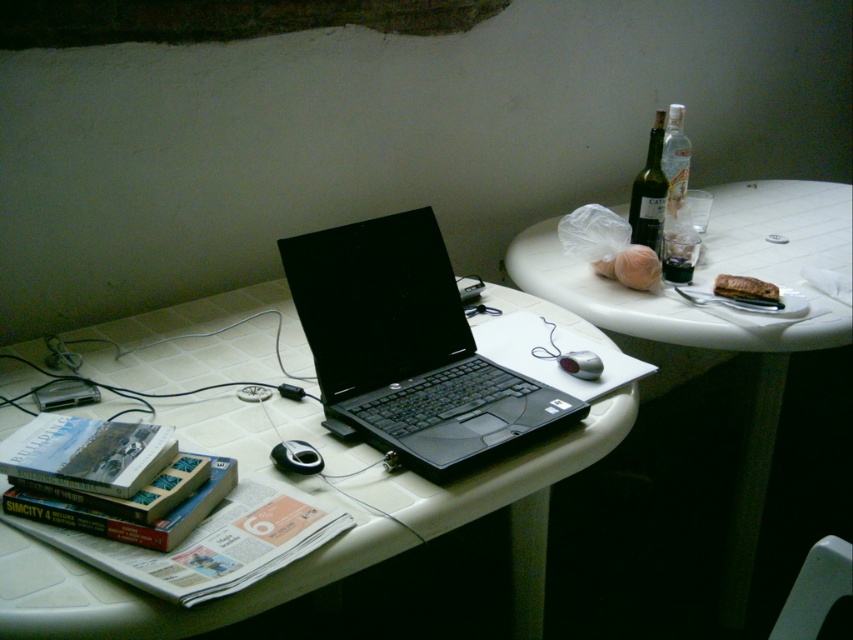
Is black plastic laptop at center positioned before white plastic plate at upper right?

Yes, it is.

Based on the photo, between black plastic laptop at center and white plastic plate at upper right, which one appears on the right side from the viewer's perspective?

white plastic plate at upper right is more to the right.

Is point (265, 342) positioned in front of point (807, 346)?

No.

Locate an element on the screen. This screenshot has height=640, width=853. black plastic laptop at center is located at coordinates (161, 602).

Who is positioned more to the right, black matte laptop at center or green glass bottle at upper right?

green glass bottle at upper right is more to the right.

Can you confirm if black matte laptop at center is positioned to the right of green glass bottle at upper right?

Incorrect, black matte laptop at center is not on the right side of green glass bottle at upper right.

Does point (329, 408) come closer to viewer compared to point (659, 124)?

Yes, it is in front of point (659, 124).

Find the location of a particular element. The image size is (853, 640). black matte laptop at center is located at coordinates (408, 348).

Describe the element at coordinates (653, 304) in the screenshot. I see `white plastic plate at upper right` at that location.

Where is `white plastic plate at upper right`? The width and height of the screenshot is (853, 640). white plastic plate at upper right is located at coordinates (653, 304).

At what (x,y) coordinates should I click in order to perform the action: click on white plastic plate at upper right. Please return your answer as a coordinate pair (x, y). Looking at the image, I should click on (653, 304).